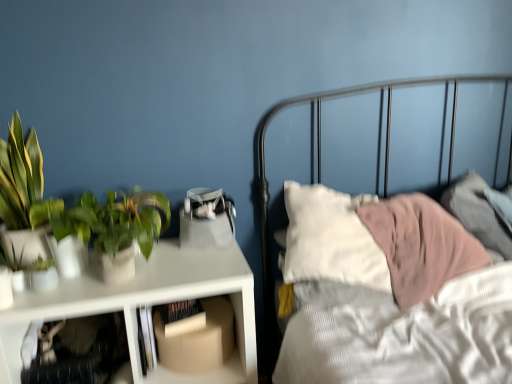
At what (x,y) coordinates should I click in order to perform the action: click on cardboard box at lower center, positioned as the first shelf in right-to-left order. Please return your answer as a coordinate pair (x, y). The width and height of the screenshot is (512, 384). Looking at the image, I should click on (199, 349).

This screenshot has width=512, height=384. What do you see at coordinates (31, 208) in the screenshot?
I see `green matte plant at left` at bounding box center [31, 208].

Describe the element at coordinates (79, 351) in the screenshot. The height and width of the screenshot is (384, 512). I see `translucent plastic shelf at lower left, the first shelf when ordered from left to right` at that location.

The width and height of the screenshot is (512, 384). Identify the location of green matte plant at left. (125, 220).

The image size is (512, 384). In order to click on cardboard box at lower center, arranged as the second shelf when viewed from the left in this screenshot , I will do `click(199, 349)`.

Between hardcover book at center and translucent plastic shelf at lower left, the first shelf when ordered from left to right, which one has smaller width?

hardcover book at center is thinner.

Where is `shelf on the left side of hardcover book at center`? The height and width of the screenshot is (384, 512). shelf on the left side of hardcover book at center is located at coordinates (79, 351).

From a real-world perspective, which is physically above, hardcover book at center or translucent plastic shelf at lower left, acting as the 2th shelf starting from the right?

From a 3D spatial view, hardcover book at center is above.

Does point (174, 335) come closer to viewer compared to point (89, 330)?

No.

How many degrees apart are the facing directions of cardboard box at lower center, arranged as the second shelf when viewed from the left, and white matte table at left?

3.93 degrees.

Where is `table on the left of cardboard box at lower center, arranged as the second shelf when viewed from the left`? table on the left of cardboard box at lower center, arranged as the second shelf when viewed from the left is located at coordinates (146, 304).

Is cardboard box at lower center, arranged as the second shelf when viewed from the left, wider or thinner than white matte table at left?

Clearly, cardboard box at lower center, arranged as the second shelf when viewed from the left, has less width compared to white matte table at left.

Which of these two, green matte plant at left or translucent plastic shelf at lower left, acting as the 2th shelf starting from the right, stands shorter?

translucent plastic shelf at lower left, acting as the 2th shelf starting from the right.

Which object is further away from the camera taking this photo, green matte plant at left or translucent plastic shelf at lower left, the first shelf when ordered from left to right?

green matte plant at left is further from the camera.

Is green matte plant at left in contact with translucent plastic shelf at lower left, acting as the 2th shelf starting from the right?

There is a gap between green matte plant at left and translucent plastic shelf at lower left, acting as the 2th shelf starting from the right.

In terms of width, does translucent plastic shelf at lower left, acting as the 2th shelf starting from the right, look wider or thinner when compared to cardboard box at lower center, arranged as the second shelf when viewed from the left?

Considering their sizes, translucent plastic shelf at lower left, acting as the 2th shelf starting from the right, looks broader than cardboard box at lower center, arranged as the second shelf when viewed from the left.

Could you measure the distance between translucent plastic shelf at lower left, acting as the 2th shelf starting from the right, and cardboard box at lower center, positioned as the first shelf in right-to-left order?

The distance of translucent plastic shelf at lower left, acting as the 2th shelf starting from the right, from cardboard box at lower center, positioned as the first shelf in right-to-left order, is 9.62 inches.

From the image's perspective, is translucent plastic shelf at lower left, acting as the 2th shelf starting from the right, under cardboard box at lower center, positioned as the first shelf in right-to-left order?

Yes.

Between translucent plastic shelf at lower left, acting as the 2th shelf starting from the right, and cardboard box at lower center, arranged as the second shelf when viewed from the left, which one appears on the left side from the viewer's perspective?

translucent plastic shelf at lower left, acting as the 2th shelf starting from the right.

Would you say cardboard box at lower center, positioned as the first shelf in right-to-left order, is outside green matte plant at left?

cardboard box at lower center, positioned as the first shelf in right-to-left order, is positioned outside green matte plant at left.

Is cardboard box at lower center, arranged as the second shelf when viewed from the left, bigger than green matte plant at left?

Incorrect, cardboard box at lower center, arranged as the second shelf when viewed from the left, is not larger than green matte plant at left.

Measure the distance from cardboard box at lower center, arranged as the second shelf when viewed from the left, to green matte plant at left.

A distance of 20.56 inches exists between cardboard box at lower center, arranged as the second shelf when viewed from the left, and green matte plant at left.

Does cardboard box at lower center, positioned as the first shelf in right-to-left order, have a lesser height compared to green matte plant at left?

Correct, cardboard box at lower center, positioned as the first shelf in right-to-left order, is not as tall as green matte plant at left.

Does cardboard box at lower center, arranged as the second shelf when viewed from the left, lie behind green matte plant at left?

Yes, it is.

Does cardboard box at lower center, positioned as the first shelf in right-to-left order, have a greater width compared to green matte plant at left?

Indeed, cardboard box at lower center, positioned as the first shelf in right-to-left order, has a greater width compared to green matte plant at left.

From their relative heights in the image, would you say cardboard box at lower center, positioned as the first shelf in right-to-left order, is taller or shorter than green matte plant at left?

cardboard box at lower center, positioned as the first shelf in right-to-left order, is shorter than green matte plant at left.

Based on the photo, are cardboard box at lower center, arranged as the second shelf when viewed from the left, and green matte plant at left beside each other?

No, cardboard box at lower center, arranged as the second shelf when viewed from the left, is not in contact with green matte plant at left.

This screenshot has height=384, width=512. I want to click on vegetation lying on the right of translucent plastic shelf at lower left, acting as the 2th shelf starting from the right, so 125,220.

From the picture: Between green matte plant at left and translucent plastic shelf at lower left, the first shelf when ordered from left to right, which one has more height?

green matte plant at left is taller.

Is green matte plant at left outside of translucent plastic shelf at lower left, acting as the 2th shelf starting from the right?

That's correct, green matte plant at left is outside of translucent plastic shelf at lower left, acting as the 2th shelf starting from the right.

Based on the photo, is green matte plant at left aimed at translucent plastic shelf at lower left, the first shelf when ordered from left to right?

No.

In order to click on the 1st shelf positioned below the hardcover book at center (from a real-world perspective) in this screenshot , I will do `click(79, 351)`.

Image resolution: width=512 pixels, height=384 pixels. In order to click on table in front of the cardboard box at lower center, arranged as the second shelf when viewed from the left in this screenshot , I will do `click(146, 304)`.

When comparing their distances from white matte table at left, does translucent plastic shelf at lower left, the first shelf when ordered from left to right, or cardboard box at lower center, positioned as the first shelf in right-to-left order, seem further?

translucent plastic shelf at lower left, the first shelf when ordered from left to right, is further to white matte table at left.

When comparing their distances from translucent plastic shelf at lower left, acting as the 2th shelf starting from the right, does hardcover book at center or green matte plant at left seem closer?

hardcover book at center is closer to translucent plastic shelf at lower left, acting as the 2th shelf starting from the right.

Consider the image. From the image, which object appears to be farther from cardboard box at lower center, positioned as the first shelf in right-to-left order, green matte plant at left or hardcover book at center?

green matte plant at left is further to cardboard box at lower center, positioned as the first shelf in right-to-left order.

Looking at the image, which one is located closer to green matte plant at left, cardboard box at lower center, arranged as the second shelf when viewed from the left, or hardcover book at center?

Based on the image, hardcover book at center appears to be nearer to green matte plant at left.

When comparing their distances from translucent plastic shelf at lower left, the first shelf when ordered from left to right, does cardboard box at lower center, arranged as the second shelf when viewed from the left, or green matte plant at left seem further?

green matte plant at left.

Estimate the real-world distances between objects in this image. Which object is closer to hardcover book at center, white matte table at left or green matte plant at left?

Based on the image, white matte table at left appears to be nearer to hardcover book at center.

Based on their spatial positions, is translucent plastic shelf at lower left, the first shelf when ordered from left to right, or green matte plant at left further from green matte plant at left?

translucent plastic shelf at lower left, the first shelf when ordered from left to right, is further to green matte plant at left.

Considering their positions, is green matte plant at left positioned further to white matte table at left than hardcover book at center?

hardcover book at center lies further to white matte table at left than the other object.

Where is `shelf between green matte plant at left and translucent plastic shelf at lower left, acting as the 2th shelf starting from the right, vertically`? shelf between green matte plant at left and translucent plastic shelf at lower left, acting as the 2th shelf starting from the right, vertically is located at coordinates (199, 349).

Where is `book between green matte plant at left and translucent plastic shelf at lower left, acting as the 2th shelf starting from the right, vertically`? book between green matte plant at left and translucent plastic shelf at lower left, acting as the 2th shelf starting from the right, vertically is located at coordinates (182, 317).

The height and width of the screenshot is (384, 512). Find the location of `book between green matte plant at left and cardboard box at lower center, arranged as the second shelf when viewed from the left, from top to bottom`. book between green matte plant at left and cardboard box at lower center, arranged as the second shelf when viewed from the left, from top to bottom is located at coordinates [182, 317].

This screenshot has height=384, width=512. In order to click on book between green matte plant at left and cardboard box at lower center, arranged as the second shelf when viewed from the left in this screenshot , I will do `click(182, 317)`.